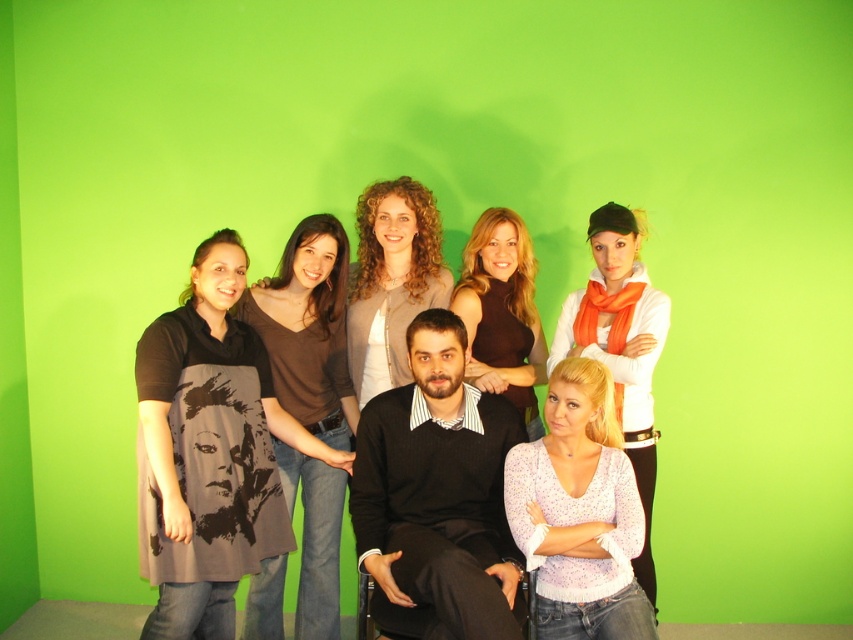
Between black sweater at center and light beige sweater at center, which one has more height?

black sweater at center

Who is positioned more to the right, black sweater at center or light beige sweater at center?

From the viewer's perspective, black sweater at center appears more on the right side.

Is point (439, 442) behind point (401, 246)?

That is False.

Locate an element on the screen. black sweater at center is located at coordinates (437, 497).

Who is more distant from viewer, (628,468) or (389,216)?

Positioned behind is point (389,216).

Is light purple knit sweater at center shorter than light beige sweater at center?

Yes.

Where is `light purple knit sweater at center`? Image resolution: width=853 pixels, height=640 pixels. light purple knit sweater at center is located at coordinates (579, 513).

Between point (357, 451) and point (589, 513), which one is positioned in front?

Point (589, 513) is more forward.

In the scene shown: Between black sweater at center and light purple knit sweater at center, which one is positioned higher?

black sweater at center

Identify the location of black sweater at center. The height and width of the screenshot is (640, 853). (437, 497).